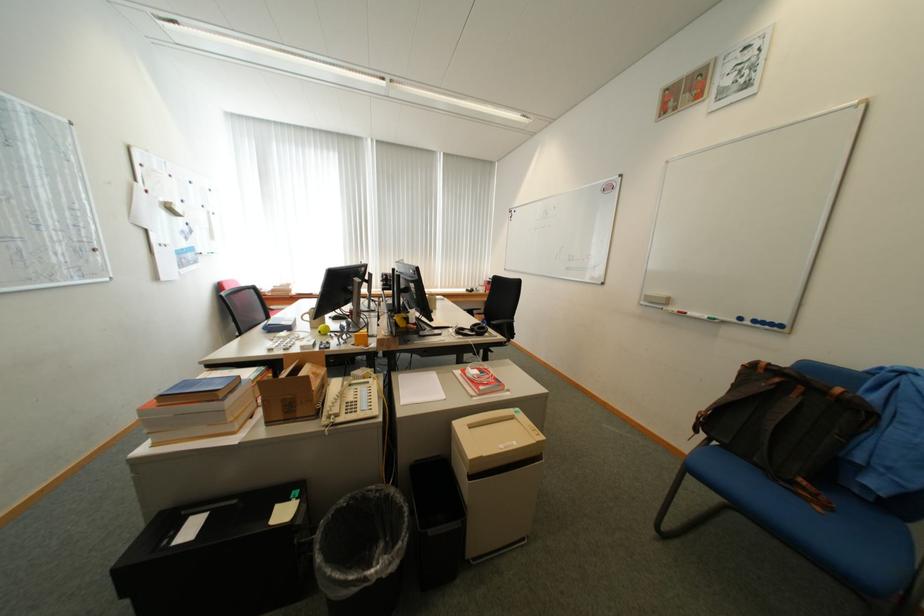
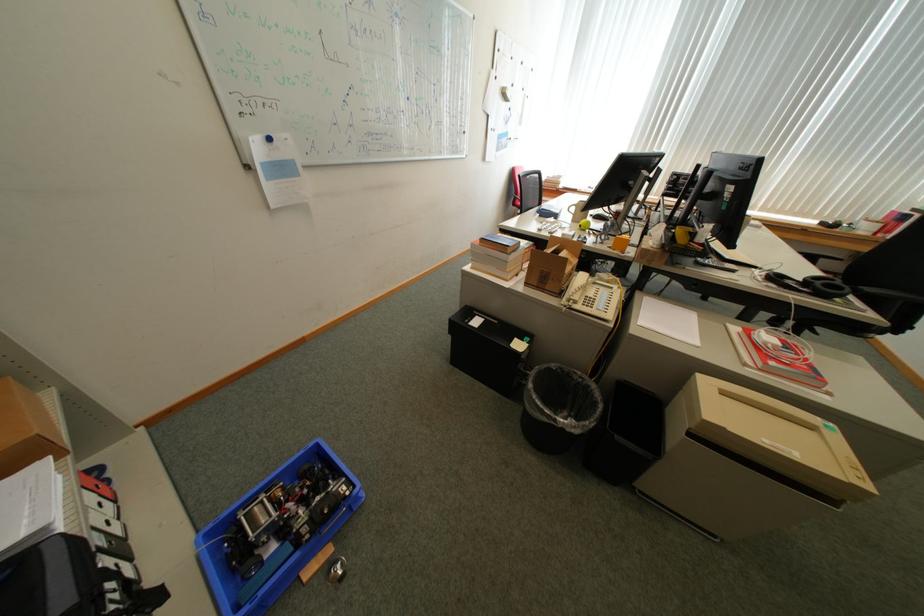
Locate, in the second image, the point that corresponds to (x=493, y=329) in the first image.

(849, 290)